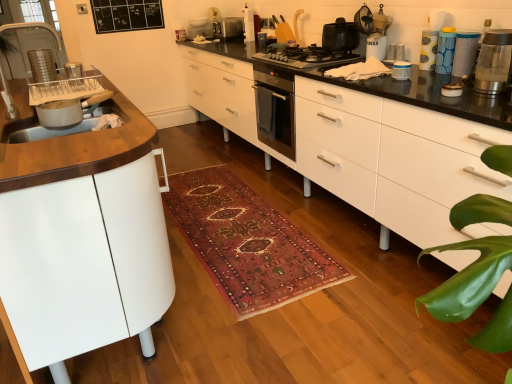
Find the location of `vacant area that is in front of blue textured canister at upper right, marked as the fourth appliance in a top-to-bottom arrangement`. vacant area that is in front of blue textured canister at upper right, marked as the fourth appliance in a top-to-bottom arrangement is located at coordinates (446, 71).